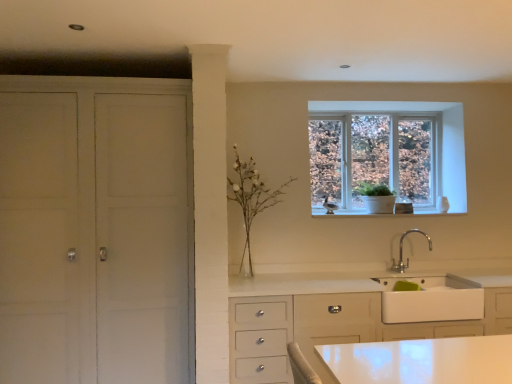
Question: Are white matte sink at lower right and white matte cabinet at left far apart?

Choices:
 (A) no
 (B) yes

Answer: (B)

Question: From the image's perspective, does white matte sink at lower right appear lower than white matte cabinet at left?

Choices:
 (A) yes
 (B) no

Answer: (A)

Question: Is white matte sink at lower right oriented away from white matte cabinet at left?

Choices:
 (A) yes
 (B) no

Answer: (B)

Question: Considering the relative sizes of white matte sink at lower right and white matte cabinet at left in the image provided, is white matte sink at lower right shorter than white matte cabinet at left?

Choices:
 (A) yes
 (B) no

Answer: (A)

Question: Is white matte sink at lower right positioned before white matte cabinet at left?

Choices:
 (A) yes
 (B) no

Answer: (B)

Question: Can you confirm if white matte sink at lower right is positioned to the left of white matte cabinet at left?

Choices:
 (A) no
 (B) yes

Answer: (A)

Question: Is chrome metallic faucet at lower right located outside white glass vase at center?

Choices:
 (A) yes
 (B) no

Answer: (A)

Question: From the image's perspective, is chrome metallic faucet at lower right located above white glass vase at center?

Choices:
 (A) no
 (B) yes

Answer: (A)

Question: From a real-world perspective, is chrome metallic faucet at lower right under white glass vase at center?

Choices:
 (A) no
 (B) yes

Answer: (B)

Question: Is chrome metallic faucet at lower right further to the viewer compared to white glass vase at center?

Choices:
 (A) no
 (B) yes

Answer: (B)

Question: Is white glass vase at center located within chrome metallic faucet at lower right?

Choices:
 (A) yes
 (B) no

Answer: (B)

Question: Does chrome metallic faucet at lower right have a lesser height compared to white glass vase at center?

Choices:
 (A) no
 (B) yes

Answer: (B)

Question: Can you confirm if clear glass window at upper center is smaller than white matte cabinet at left?

Choices:
 (A) yes
 (B) no

Answer: (A)